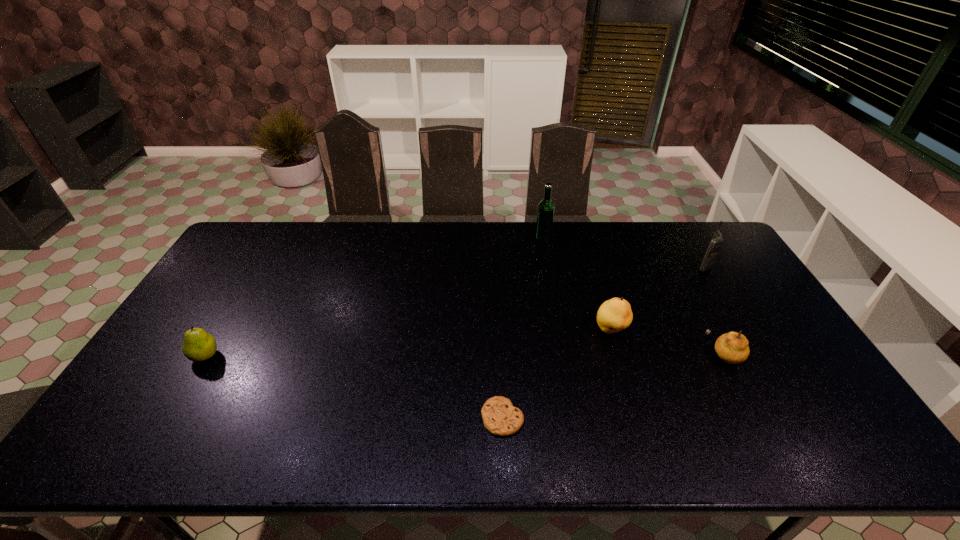
This screenshot has height=540, width=960. What are the coordinates of `the closest pear to the leftmost pear` in the screenshot? It's located at (614, 315).

Locate which pear ranks second in proximity to the leftmost object. Please provide its 2D coordinates. Your answer should be formatted as a tuple, i.e. [(x, y)], where the tuple contains the x and y coordinates of a point satisfying the conditions above.

[(732, 347)]

Find the location of `free space that satisfies the following two spatial constraints: 1. on the front side of the rightmost pear; 2. on the right side of the third object from left to right`. free space that satisfies the following two spatial constraints: 1. on the front side of the rightmost pear; 2. on the right side of the third object from left to right is located at coordinates (564, 354).

The image size is (960, 540). Identify the location of vacant space that satisfies the following two spatial constraints: 1. on the keyboard of the rightmost object; 2. on the front side of the fifth object from left to right. (756, 354).

Where is `free point that satisfies the following two spatial constraints: 1. on the keyboard of the cellular telephone; 2. on the front side of the leftmost pear`? This screenshot has width=960, height=540. free point that satisfies the following two spatial constraints: 1. on the keyboard of the cellular telephone; 2. on the front side of the leftmost pear is located at coordinates (757, 356).